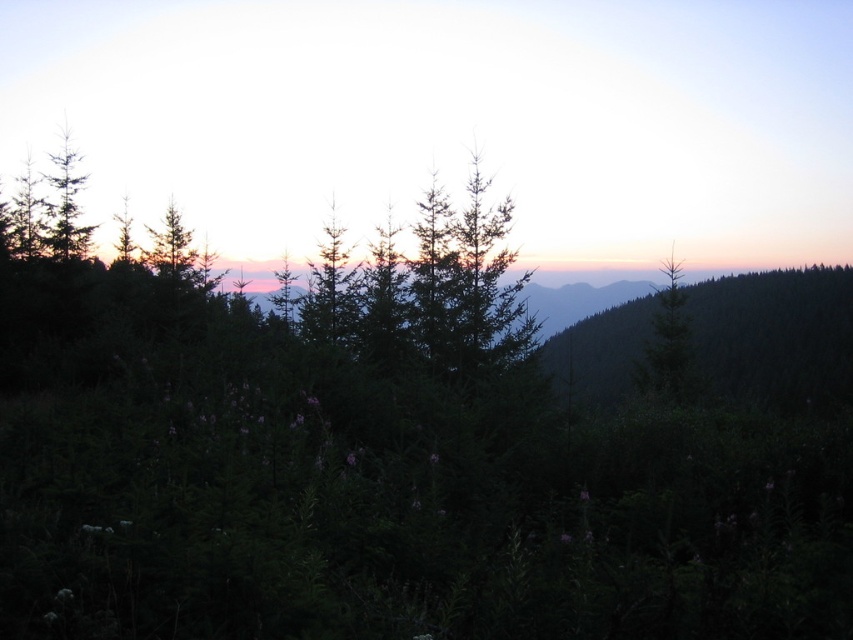
Question: Which point is farther from the camera taking this photo?

Choices:
 (A) (680, 353)
 (B) (412, 12)

Answer: (B)

Question: Which of the following is the closest to the observer?

Choices:
 (A) silhouetted evergreen trees at upper center
 (B) green matte tree at right

Answer: (B)

Question: Is silhouetted evergreen trees at upper center to the right of green matte tree at right from the viewer's perspective?

Choices:
 (A) no
 (B) yes

Answer: (A)

Question: Which point is farther from the camera taking this photo?

Choices:
 (A) (547, 26)
 (B) (668, 301)

Answer: (A)

Question: Does silhouetted evergreen trees at upper center have a larger size compared to green matte tree at right?

Choices:
 (A) no
 (B) yes

Answer: (B)

Question: Does silhouetted evergreen trees at upper center have a greater width compared to green matte tree at right?

Choices:
 (A) yes
 (B) no

Answer: (A)